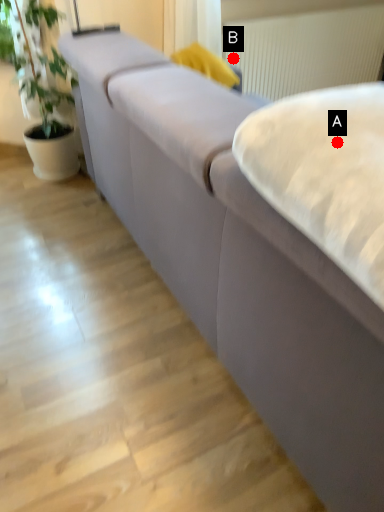
Question: Two points are circled on the image, labeled by A and B beside each circle. Which point appears farthest from the camera in this image?

Choices:
 (A) A is further
 (B) B is further

Answer: (B)